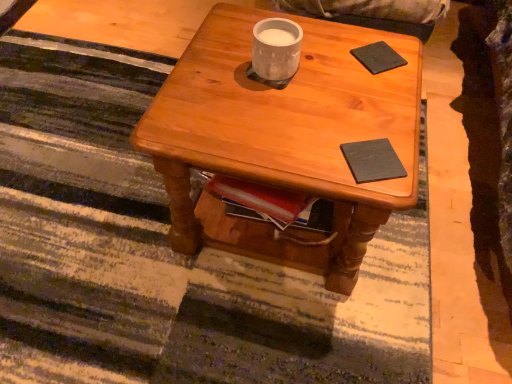
Question: Considering the positions of dark matte book at center, the 1th pad positioned from the bottom, and black matte pad at upper right, the first pad viewed from the back, in the image, is dark matte book at center, the 1th pad positioned from the bottom, wider or thinner than black matte pad at upper right, the first pad viewed from the back,?

Choices:
 (A) wide
 (B) thin

Answer: (B)

Question: Does point (396, 157) appear closer or farther from the camera than point (364, 54)?

Choices:
 (A) closer
 (B) farther

Answer: (A)

Question: Estimate the real-world distances between objects in this image. Which object is farther from the dark matte book at center, positioned as the second pad in back-to-front order?

Choices:
 (A) white matte cup at center
 (B) wooden coffee table at center
 (C) black matte pad at upper right, the second pad in the front-to-back sequence

Answer: (C)

Question: Estimate the real-world distances between objects in this image. Which object is farther from the black matte pad at upper right, placed as the second pad when sorted from bottom to top?

Choices:
 (A) wooden coffee table at center
 (B) white matte cup at center
 (C) dark matte book at center, the 1th pad positioned from the bottom

Answer: (A)